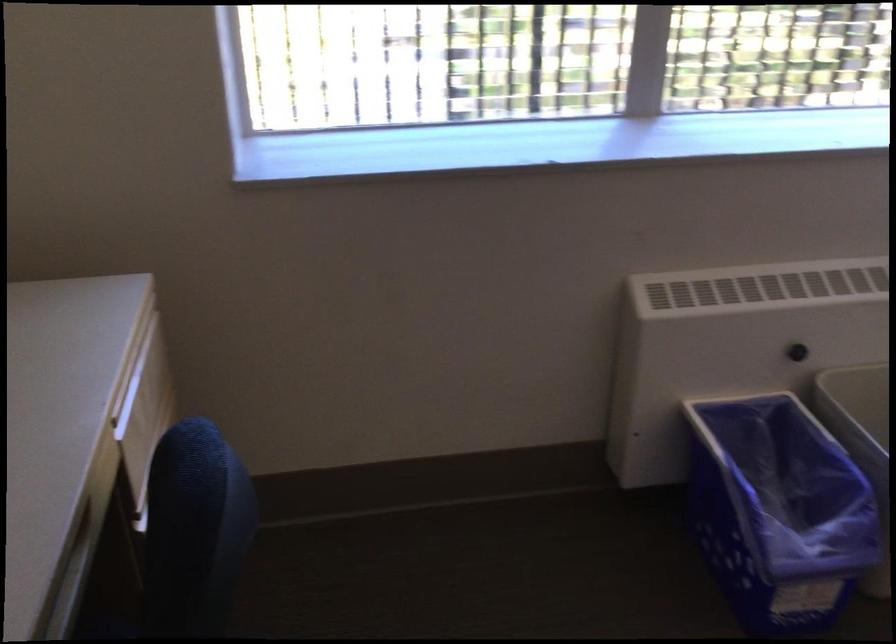
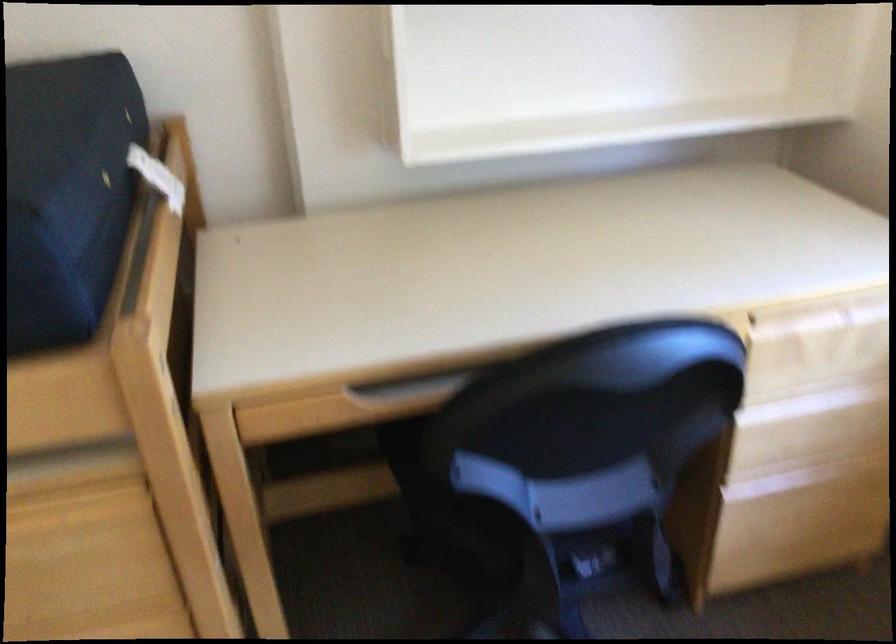
The first image is from the beginning of the video and the second image is from the end. How did the camera likely rotate when shooting the video?

The camera rotated toward left-down.